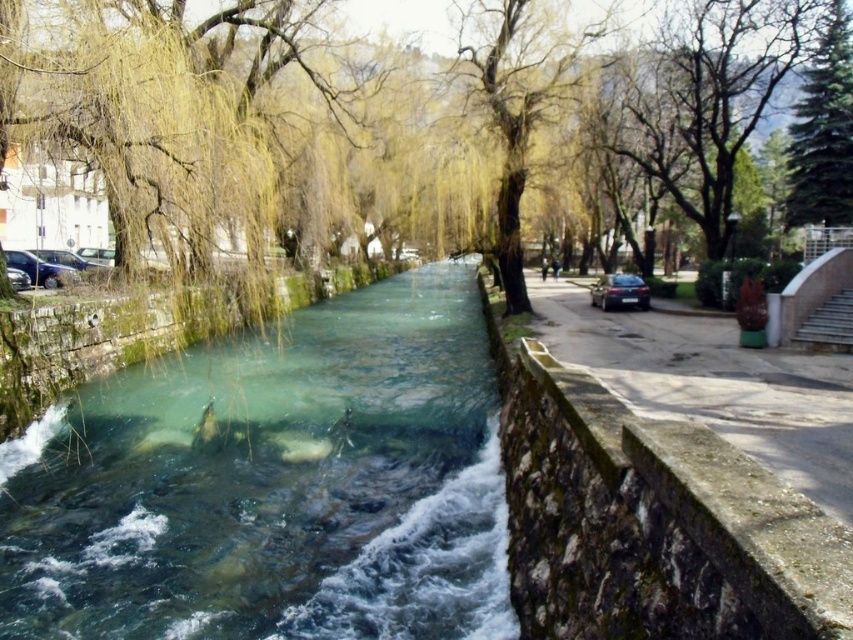
Image resolution: width=853 pixels, height=640 pixels. Identify the location of yellow-green leafy tree at center. (515, 104).

Who is higher up, yellow-green leafy tree at center or satin black car at right?

yellow-green leafy tree at center is higher up.

Between point (527, 124) and point (624, 298), which one is positioned in front?

Point (527, 124) is in front.

Locate an element on the screen. The width and height of the screenshot is (853, 640). yellow-green leafy tree at center is located at coordinates (515, 104).

Is point (293, 605) behind point (846, 154)?

No, it is in front of (846, 154).

Is clear stone stream at center further to camera compared to green fir tree at upper right?

No, clear stone stream at center is in front of green fir tree at upper right.

Is point (3, 634) in front of point (836, 132)?

That is True.

Identify the location of clear stone stream at center. (271, 483).

Is point (325, 385) less distant than point (606, 308)?

Yes, it is.

Is clear stone stream at center to the left of satin black car at right from the viewer's perspective?

Yes, clear stone stream at center is to the left of satin black car at right.

Is point (120, 566) closer to camera compared to point (612, 275)?

Yes.

Where is `clear stone stream at center`? This screenshot has height=640, width=853. clear stone stream at center is located at coordinates (271, 483).